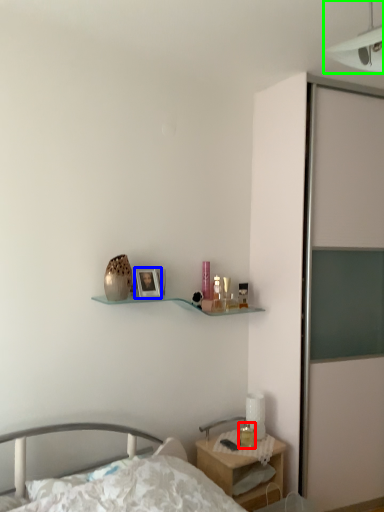
Question: Estimate the real-world distances between objects in this image. Which object is closer to candle holder (highlighted by a red box), picture frame (highlighted by a blue box) or light fixture (highlighted by a green box)?

Choices:
 (A) picture frame
 (B) light fixture

Answer: (A)